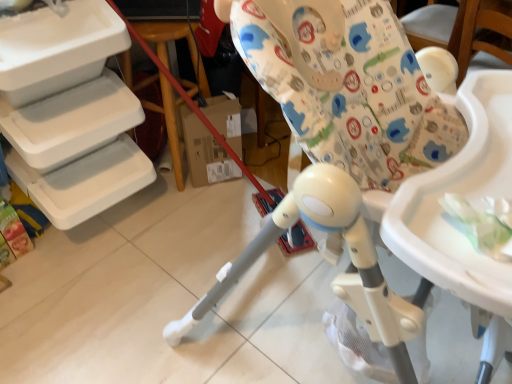
Question: Is white plastic highchair at center a part of wooden at left?

Choices:
 (A) yes
 (B) no

Answer: (B)

Question: From the image's perspective, does wooden at left appear lower than white plastic highchair at center?

Choices:
 (A) yes
 (B) no

Answer: (B)

Question: From a real-world perspective, is wooden at left beneath white plastic highchair at center?

Choices:
 (A) yes
 (B) no

Answer: (A)

Question: Is wooden at left further to camera compared to white plastic highchair at center?

Choices:
 (A) no
 (B) yes

Answer: (B)

Question: Can you confirm if wooden at left is shorter than white plastic highchair at center?

Choices:
 (A) yes
 (B) no

Answer: (A)

Question: Considering the relative sizes of wooden at left and white plastic highchair at center in the image provided, is wooden at left taller than white plastic highchair at center?

Choices:
 (A) no
 (B) yes

Answer: (A)

Question: From the image's perspective, is white plastic highchair at center above wooden at left?

Choices:
 (A) no
 (B) yes

Answer: (A)

Question: Is white plastic highchair at center turned away from wooden at left?

Choices:
 (A) yes
 (B) no

Answer: (A)

Question: From the image's perspective, is white plastic highchair at center below wooden at left?

Choices:
 (A) no
 (B) yes

Answer: (B)

Question: Is white plastic highchair at center far from wooden at left?

Choices:
 (A) no
 (B) yes

Answer: (A)

Question: Is white plastic highchair at center aimed at wooden at left?

Choices:
 (A) yes
 (B) no

Answer: (B)

Question: From a real-world perspective, is white plastic highchair at center physically below wooden at left?

Choices:
 (A) no
 (B) yes

Answer: (A)

Question: From the image's perspective, relative to wooden at left, is white plastic highchair at center above or below?

Choices:
 (A) above
 (B) below

Answer: (B)